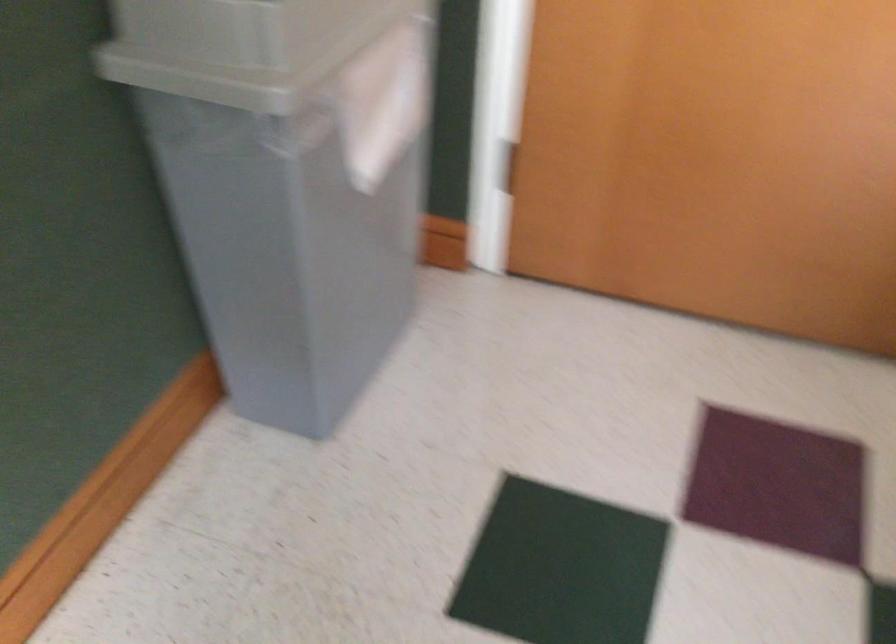
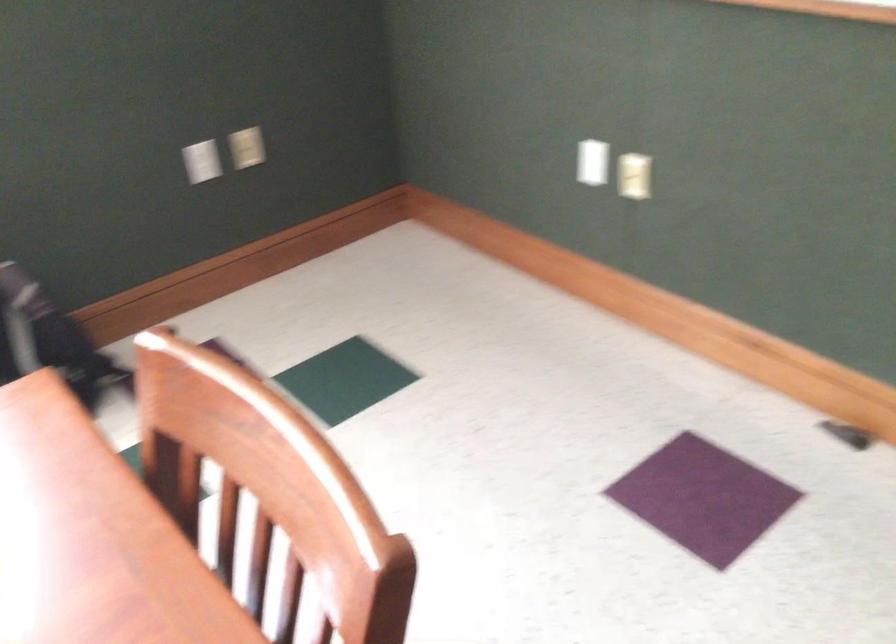
Based on the continuous images, in which direction is the camera rotating?

The rotation direction of the camera is left-down.